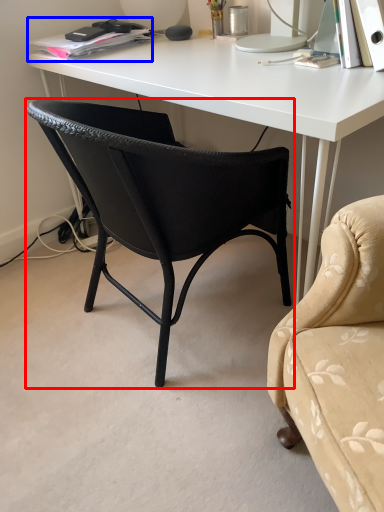
Question: Which object appears farthest to the camera in this image, chair (highlighted by a red box) or book (highlighted by a blue box)?

Choices:
 (A) chair
 (B) book

Answer: (B)